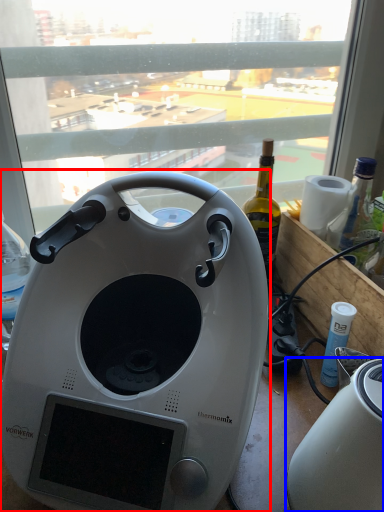
Question: Which of the following is the farthest to the observer, home appliance (highlighted by a red box) or toaster (highlighted by a blue box)?

Choices:
 (A) home appliance
 (B) toaster

Answer: (A)